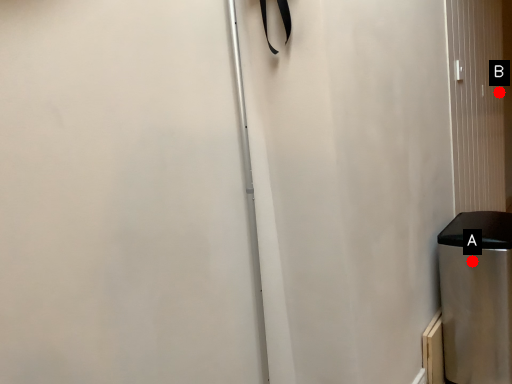
Question: Two points are circled on the image, labeled by A and B beside each circle. Which point is farther from the camera taking this photo?

Choices:
 (A) A is further
 (B) B is further

Answer: (B)